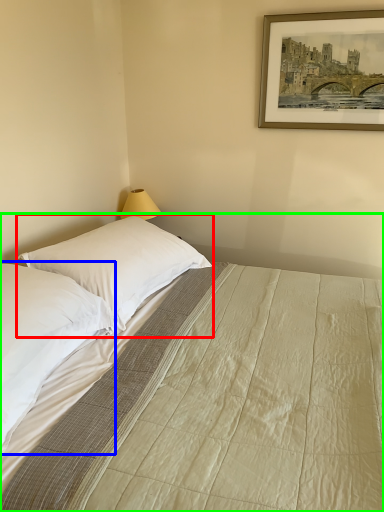
Question: Which is farther away from pillow (highlighted by a red box)? pillow (highlighted by a blue box) or bed (highlighted by a green box)?

Choices:
 (A) pillow
 (B) bed

Answer: (A)